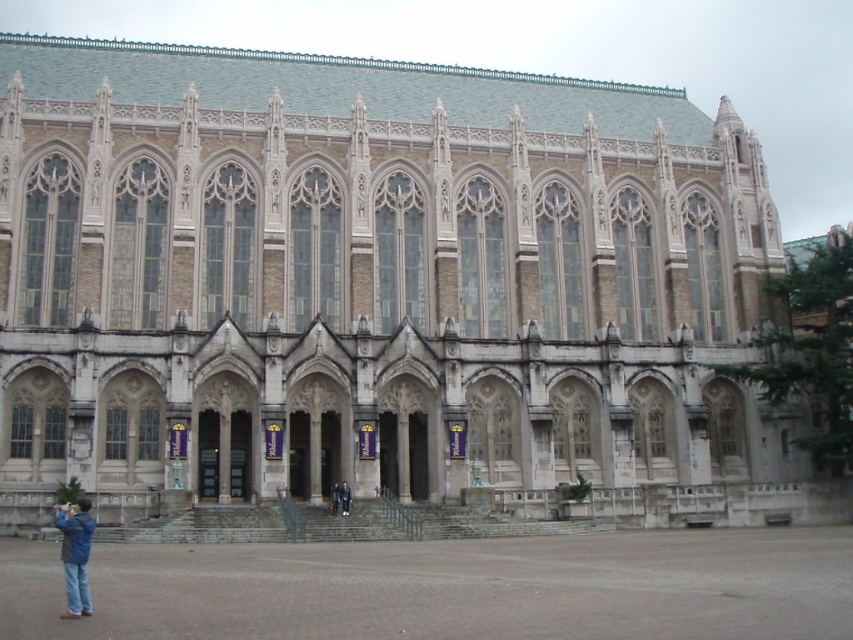
Question: Is dark blue jeans at lower center below dark blue jacket at center?

Choices:
 (A) no
 (B) yes

Answer: (A)

Question: Which point is closer to the camera?

Choices:
 (A) blue denim jacket at lower left
 (B) dark blue jacket at center
 (C) dark blue jeans at lower center

Answer: (A)

Question: Is dark blue jeans at lower center wider than dark blue jacket at center?

Choices:
 (A) no
 (B) yes

Answer: (B)

Question: Among these objects, which one is nearest to the camera?

Choices:
 (A) dark blue jacket at center
 (B) blue denim jacket at lower left

Answer: (B)

Question: Among these points, which one is nearest to the camera?

Choices:
 (A) (337, 492)
 (B) (80, 532)
 (C) (346, 512)

Answer: (B)

Question: Is blue denim jacket at lower left positioned at the back of dark blue jacket at center?

Choices:
 (A) no
 (B) yes

Answer: (A)